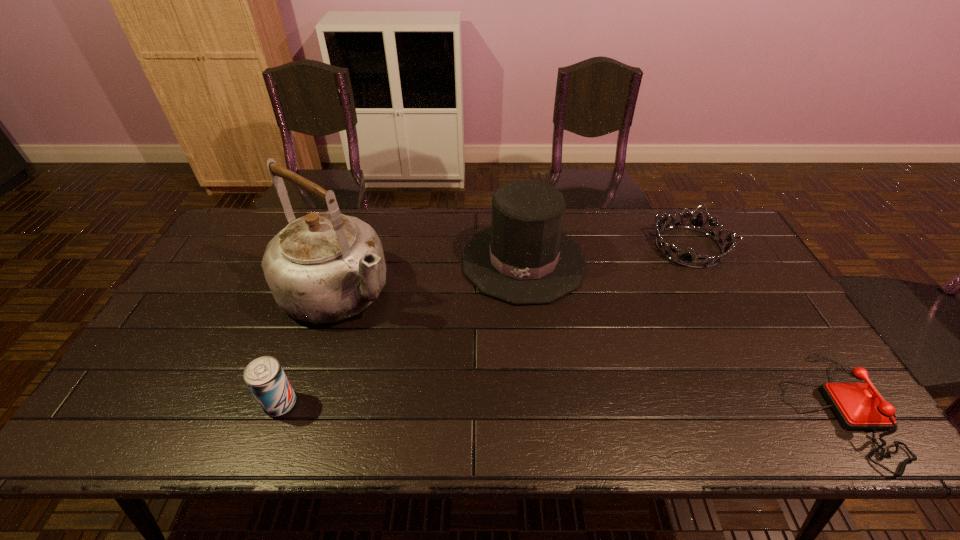
Locate an element on the screen. free space between the third tallest object and the telephone is located at coordinates (559, 407).

The height and width of the screenshot is (540, 960). What are the coordinates of `free point between the third shortest object and the tiara` in the screenshot? It's located at 485,325.

The height and width of the screenshot is (540, 960). Identify the location of vacant space in between the third shortest object and the dress hat. (402, 333).

Where is `free space between the telephone and the kettle`? free space between the telephone and the kettle is located at coordinates (588, 349).

At what (x,y) coordinates should I click in order to perform the action: click on free space between the telephone and the third shortest object. Please return your answer as a coordinate pair (x, y). This screenshot has height=540, width=960. Looking at the image, I should click on (559, 407).

The image size is (960, 540). In order to click on free spot between the tiara and the beer can in this screenshot , I will do `click(485, 325)`.

Locate an element on the screen. free space between the tallest object and the telephone is located at coordinates (588, 349).

The height and width of the screenshot is (540, 960). Identify the location of free space between the tiara and the third tallest object. (485, 325).

Identify which object is the fourth closest to the beer can. Please provide its 2D coordinates. Your answer should be formatted as a tuple, i.e. [(x, y)], where the tuple contains the x and y coordinates of a point satisfying the conditions above.

[(857, 405)]

Where is `object that is the second closest one to the tiara`? This screenshot has height=540, width=960. object that is the second closest one to the tiara is located at coordinates (857, 405).